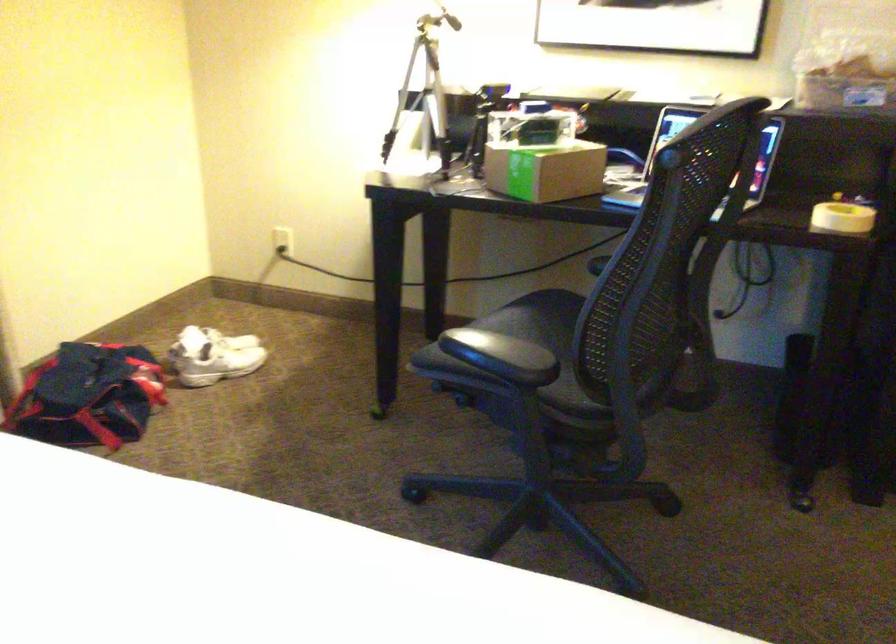
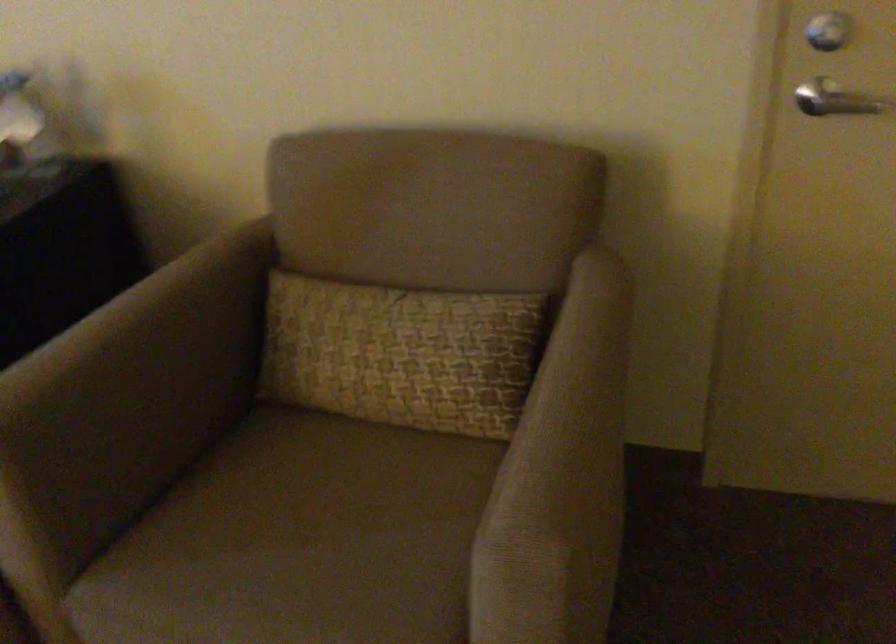
Question: What movement of the cameraman would produce the second image?

Choices:
 (A) Left
 (B) Right
 (C) Forward
 (D) Backward

Answer: (B)